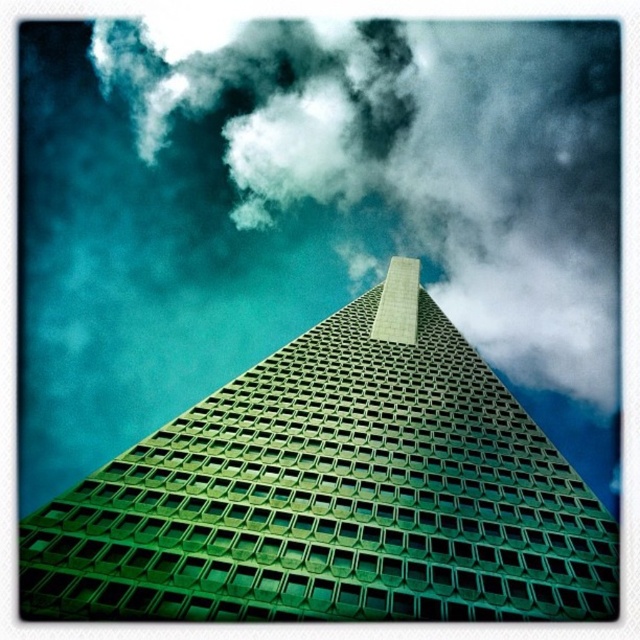
You are standing at the base of the green glassy building at center and looking up. There is a white fluffy cloud at upper center in the sky. Which object is closer to your eyes?

The green glassy building at center is closer to the viewer than the white fluffy cloud at upper center.

You are standing at the base of the green glassy building at center and looking up. Can you see the white fluffy cloud at upper center above the building?

Yes, the green glassy building at center is below the white fluffy cloud at upper center, so you can see the white fluffy cloud at upper center above the building.

You are standing at the base of the skyscraper looking up. You notice two points marked on the building facade. The first point is at coordinates point (x=202, y=598) and the second is at point (x=444, y=224). From your perspective, which point appears closer to you?

Point (x=202, y=598) is in front of point (x=444, y=224), so it appears closer to you.